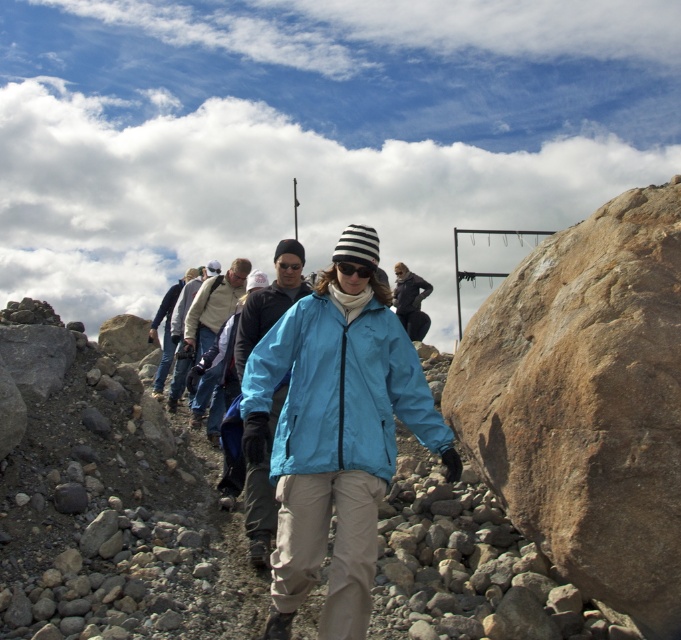
Question: Which point is closer to the camera?

Choices:
 (A) matte blue jacket at center
 (B) black matte sunglasses at center
 (C) light blue fabric jacket at center
 (D) light gray fleece jacket at center

Answer: (A)

Question: From the image, what is the correct spatial relationship of light gray fleece jacket at center in relation to black matte sunglasses at center?

Choices:
 (A) left
 (B) right

Answer: (A)

Question: Can you confirm if light blue fabric jacket at center is positioned to the left of blue fabric jacket at center?

Choices:
 (A) yes
 (B) no

Answer: (A)

Question: Which point is farther to the camera?

Choices:
 (A) (413, 301)
 (B) (242, 346)
 (C) (612, 422)

Answer: (A)

Question: Which is farther from the blue fabric jacket at center?

Choices:
 (A) matte blue jacket at center
 (B) light gray fleece jacket at center

Answer: (A)

Question: Does brown rough rock at right appear under blue fabric jacket at center?

Choices:
 (A) no
 (B) yes

Answer: (B)